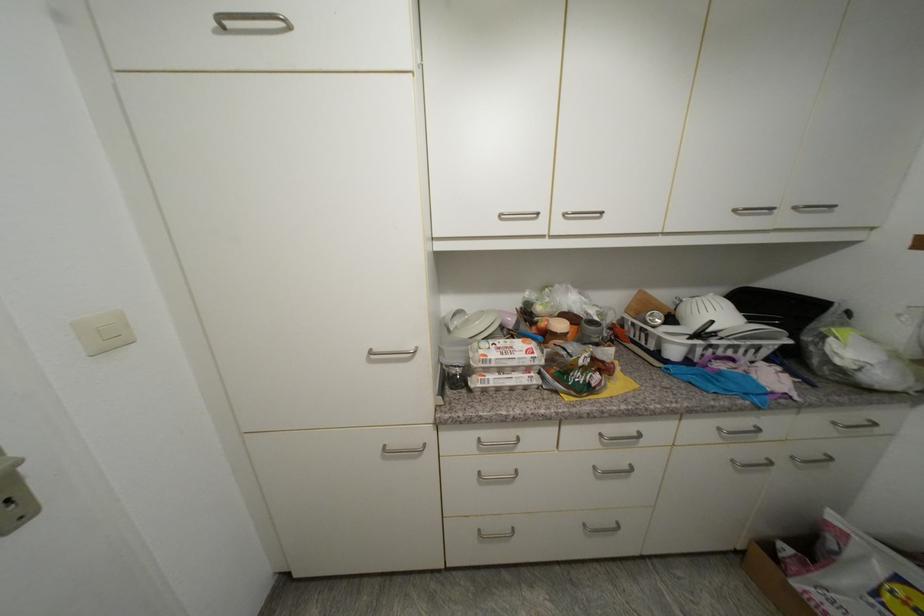
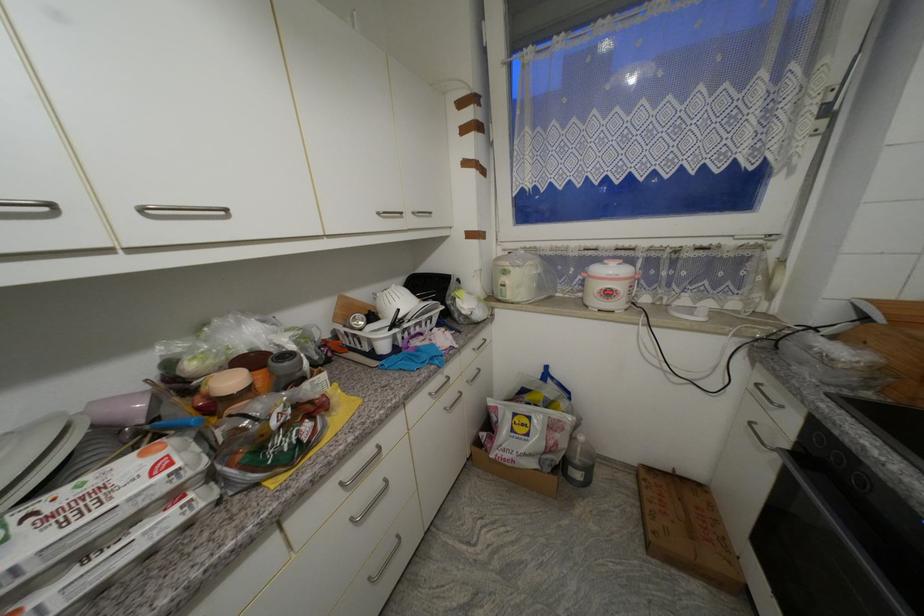
Where in the second image is the point corresponding to point (517, 322) from the first image?

(146, 408)